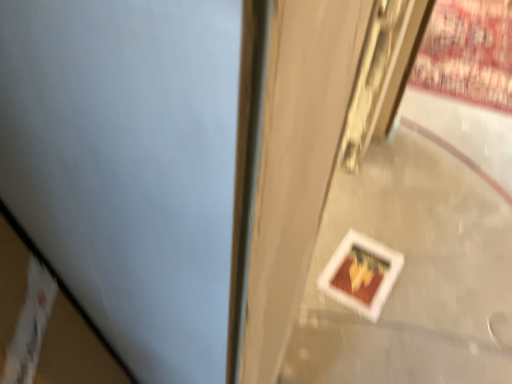
This screenshot has width=512, height=384. Identify the location of free space on the front side of matte white postcard at lower right. (387, 359).